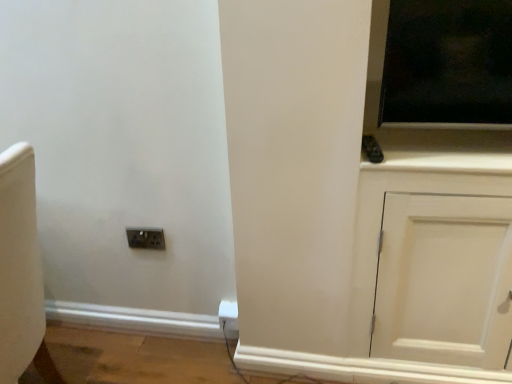
This screenshot has height=384, width=512. In order to click on white plastic electric outlet at lower center in this screenshot , I will do `click(229, 317)`.

Describe the element at coordinates (229, 317) in the screenshot. I see `white plastic electric outlet at lower center` at that location.

Image resolution: width=512 pixels, height=384 pixels. I want to click on white matte cabinet at right, so click(436, 258).

In the image, there is a white matte cabinet at right. Identify the location of electric outlet below it (from a real-world perspective). This screenshot has width=512, height=384. (229, 317).

In terms of height, does white plastic electric outlet at lower center look taller or shorter compared to white matte cabinet at right?

Clearly, white plastic electric outlet at lower center is shorter compared to white matte cabinet at right.

From a real-world perspective, between white plastic electric outlet at lower center and white matte cabinet at right, who is vertically higher?

white matte cabinet at right is physically above.

Which is more to the right, white plastic electric outlet at lower center or white matte cabinet at right?

white matte cabinet at right is more to the right.

Can you confirm if white plastic electric outlet at lower center is bigger than metallic socket at lower left?

Yes.

Is white plastic electric outlet at lower center situated inside metallic socket at lower left or outside?

white plastic electric outlet at lower center is not enclosed by metallic socket at lower left.

Is white plastic electric outlet at lower center oriented away from metallic socket at lower left?

white plastic electric outlet at lower center is not turned away from metallic socket at lower left.

Which is more to the left, white plastic electric outlet at lower center or metallic socket at lower left?

From the viewer's perspective, metallic socket at lower left appears more on the left side.

From the image's perspective, which is above, metallic socket at lower left or white plastic electric outlet at lower center?

metallic socket at lower left, from the image's perspective.

Does metallic socket at lower left have a larger size compared to white plastic electric outlet at lower center?

No, metallic socket at lower left is not bigger than white plastic electric outlet at lower center.

You are a GUI agent. You are given a task and a screenshot of the screen. Output one action in this format:
    pyautogui.click(x=<x>, y=<y>)
    Task: Click on the socket in front of the white plastic electric outlet at lower center
    The image size is (512, 384).
    Given the screenshot: What is the action you would take?
    pyautogui.click(x=146, y=238)

From a real-world perspective, which object rests below the other?

white plastic electric outlet at lower center.

From the image's perspective, is white matte cabinet at right above white plastic electric outlet at lower center?

Correct, white matte cabinet at right appears higher than white plastic electric outlet at lower center in the image.

From a real-world perspective, is white matte cabinet at right positioned above or below white plastic electric outlet at lower center?

Clearly, from a real-world perspective, white matte cabinet at right is above white plastic electric outlet at lower center.

This screenshot has width=512, height=384. Identify the location of cabinetry on the right side of white plastic electric outlet at lower center. (436, 258).

Is white matte cabinet at right aimed at white plastic electric outlet at lower center?

No, white matte cabinet at right is not aimed at white plastic electric outlet at lower center.

Looking at this image, which is more distant, [391,228] or [157,232]?

The point [157,232] is more distant.

How far apart are white matte cabinet at right and metallic socket at lower left?

They are 38.05 inches apart.

Between white matte cabinet at right and metallic socket at lower left, which one is positioned in front?

white matte cabinet at right is more forward.

Identify the location of cabinetry that is on the right side of metallic socket at lower left. This screenshot has width=512, height=384. (436, 258).

Is metallic socket at lower left in contact with white matte cabinet at right?

No, metallic socket at lower left is not in contact with white matte cabinet at right.

Identify the location of cabinetry below the metallic socket at lower left (from a real-world perspective). Image resolution: width=512 pixels, height=384 pixels. (436, 258).

Considering the sizes of objects metallic socket at lower left and white matte cabinet at right in the image provided, who is wider, metallic socket at lower left or white matte cabinet at right?

Wider between the two is white matte cabinet at right.

From a real-world perspective, which is physically below, metallic socket at lower left or white matte cabinet at right?

white matte cabinet at right is physically lower.

I want to click on electric outlet lying below the white matte cabinet at right (from the image's perspective), so click(x=229, y=317).

You are a GUI agent. You are given a task and a screenshot of the screen. Output one action in this format:
    pyautogui.click(x=<x>, y=<y>)
    Task: Click on the socket that is above the white plastic electric outlet at lower center (from a real-world perspective)
    
    Given the screenshot: What is the action you would take?
    pyautogui.click(x=146, y=238)

Looking at the image, which one is located closer to metallic socket at lower left, white plastic electric outlet at lower center or white matte cabinet at right?

white plastic electric outlet at lower center.

Based on their spatial positions, is metallic socket at lower left or white matte cabinet at right closer to white plastic electric outlet at lower center?

metallic socket at lower left.

Based on their spatial positions, is white matte cabinet at right or white plastic electric outlet at lower center further from metallic socket at lower left?

The object further to metallic socket at lower left is white matte cabinet at right.

From the image, which object appears to be nearer to white plastic electric outlet at lower center, white matte cabinet at right or metallic socket at lower left?

metallic socket at lower left.

Estimate the real-world distances between objects in this image. Which object is closer to white matte cabinet at right, metallic socket at lower left or white plastic electric outlet at lower center?

Based on the image, white plastic electric outlet at lower center appears to be nearer to white matte cabinet at right.

From the image, which object appears to be nearer to white matte cabinet at right, white plastic electric outlet at lower center or metallic socket at lower left?

Based on the image, white plastic electric outlet at lower center appears to be nearer to white matte cabinet at right.

At what (x,y) coordinates should I click in order to perform the action: click on electric outlet situated between metallic socket at lower left and white matte cabinet at right from left to right. Please return your answer as a coordinate pair (x, y). This screenshot has width=512, height=384. Looking at the image, I should click on (229, 317).